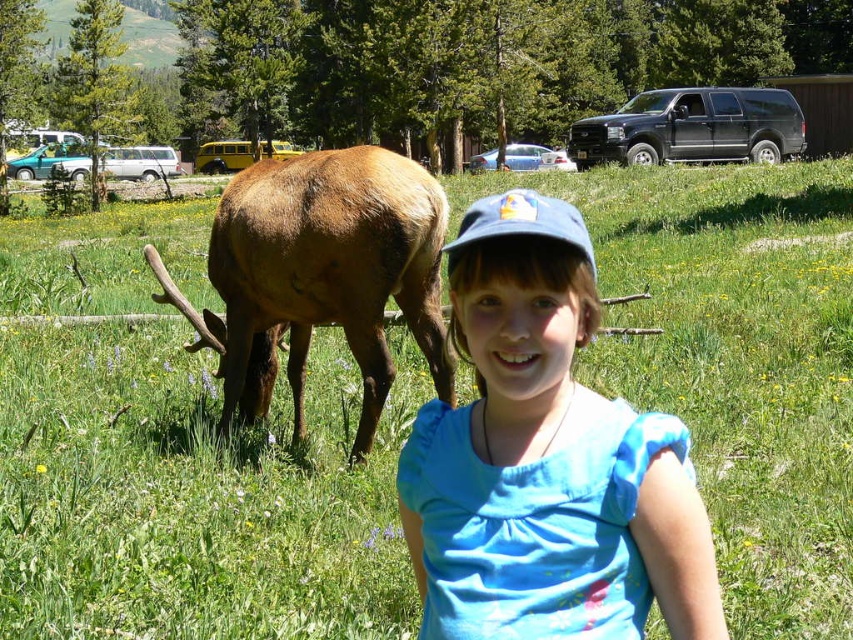
Question: In this image, where is blue cotton shirt at center located relative to blue fabric baseball cap at center?

Choices:
 (A) left
 (B) right

Answer: (A)

Question: Considering the relative positions of blue cotton shirt at center and blue fabric baseball cap at center in the image provided, where is blue cotton shirt at center located with respect to blue fabric baseball cap at center?

Choices:
 (A) above
 (B) below

Answer: (B)

Question: Which is nearer to the blue fabric baseball cap at center?

Choices:
 (A) blue cotton shirt at center
 (B) brown furry deer at left

Answer: (A)

Question: Can you confirm if brown furry deer at left is positioned to the left of blue fabric baseball cap at center?

Choices:
 (A) no
 (B) yes

Answer: (B)

Question: Estimate the real-world distances between objects in this image. Which object is closer to the brown furry deer at left?

Choices:
 (A) blue fabric baseball cap at center
 (B) blue cotton shirt at center

Answer: (A)

Question: Which object is the closest to the brown furry deer at left?

Choices:
 (A) blue cotton shirt at center
 (B) blue fabric baseball cap at center

Answer: (B)